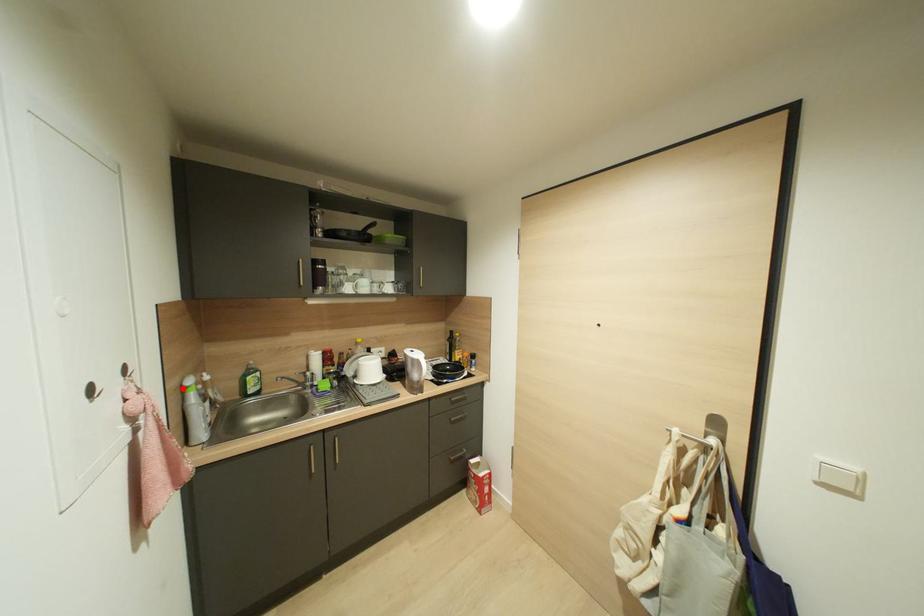
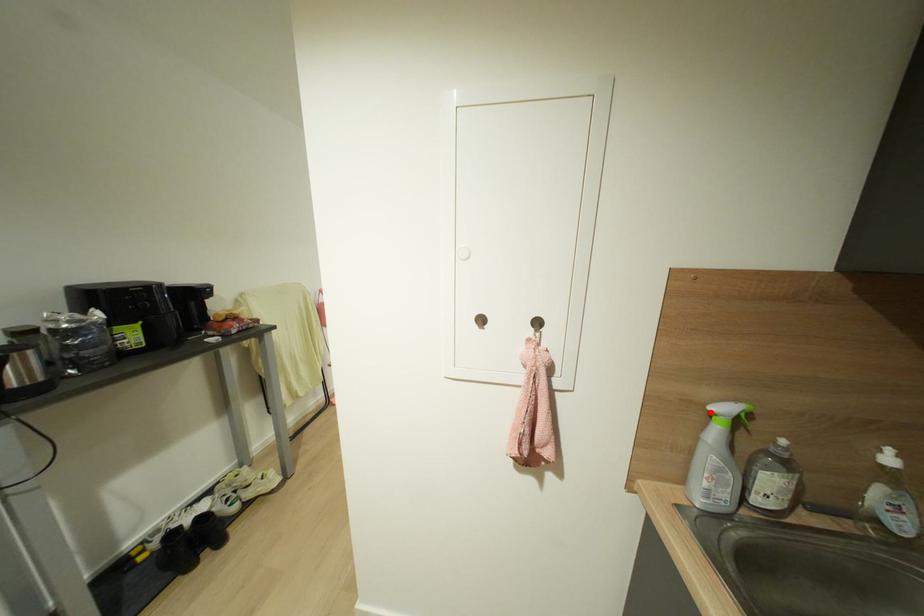
I am providing you with two images of the same scene from different viewpoints. A red point is marked on the first image and another point is marked on the second image. Do the highlighted points in image1 and image2 indicate the same real-world spot?

Yes